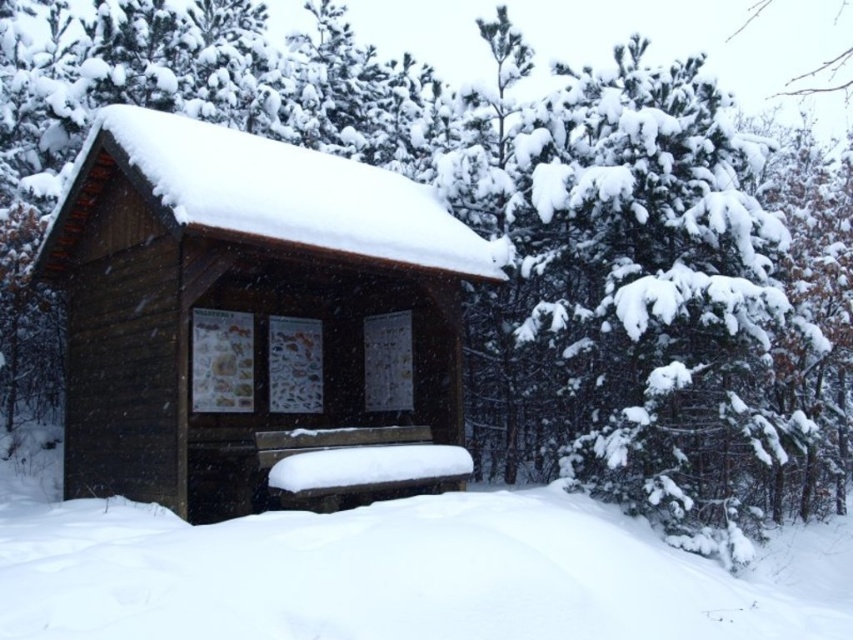
You are an explorer in a snowy forest. You need to build a fire to stay warm. You see a wooden log cabin at center and a white fluffy snow at lower center. Which object can you use to gather wood for the fire?

The wooden log cabin at center is positioned over white fluffy snow at lower center, so you can gather wood from the wooden log cabin at center to build a fire.

You are standing in the snowy forest and see the wooden log cabin at center. Can you tell me where the point at coordinates point (248, 314) is located?

The point at coordinates point (248, 314) is located on the wooden log cabin at center.